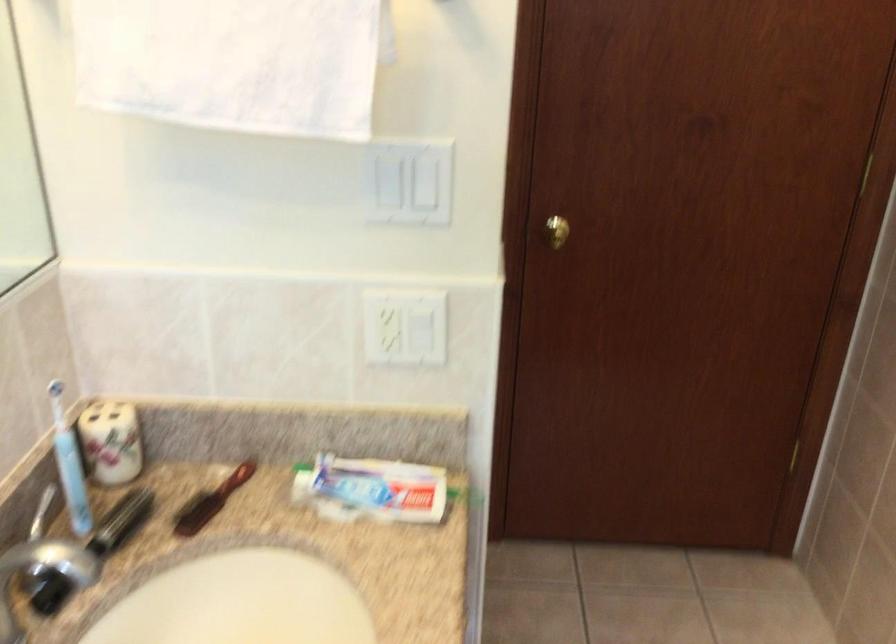
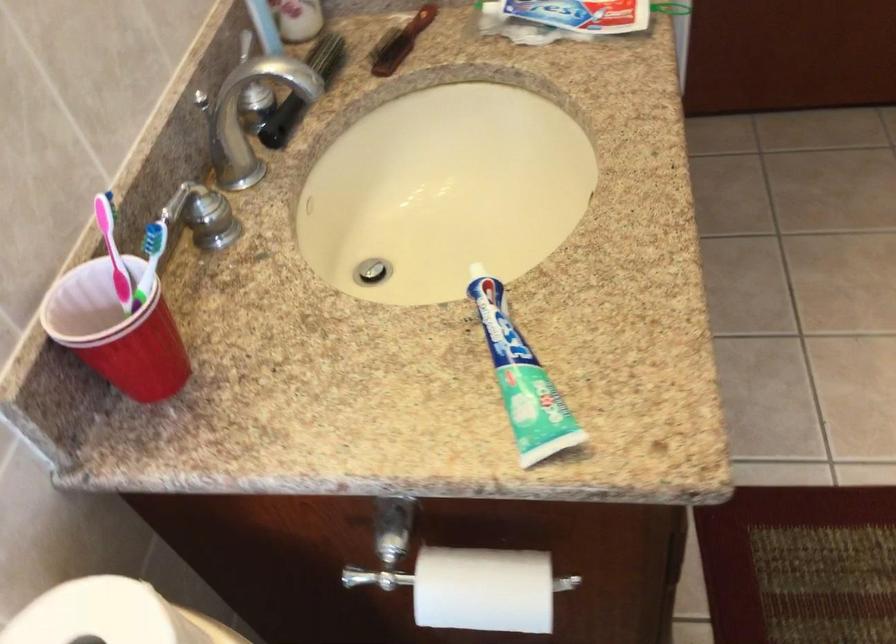
In the second image, find the point that corresponds to (x=205, y=504) in the first image.

(400, 42)